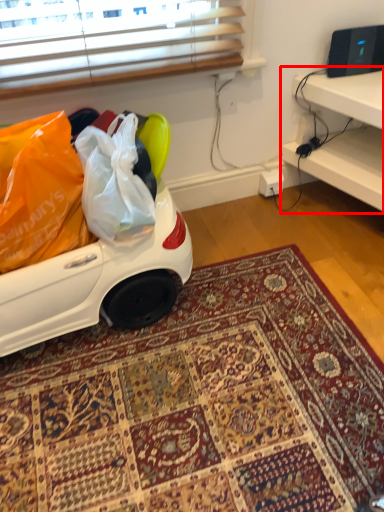
Question: From the image's perspective, what is the correct spatial positioning of furniture (annotated by the red box) in reference to mat?

Choices:
 (A) below
 (B) above

Answer: (B)